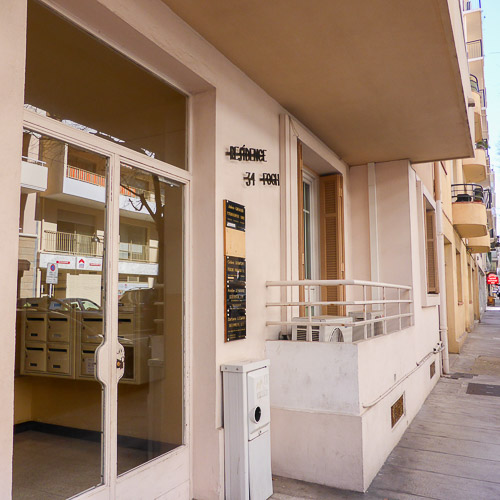
I want to click on glass, so click(x=149, y=316), click(x=79, y=356).